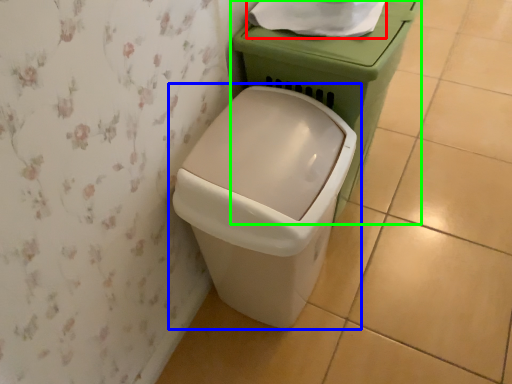
Question: Which is farther away from toilet paper (highlighted by a red box)? waste container (highlighted by a blue box) or porcelain (highlighted by a green box)?

Choices:
 (A) waste container
 (B) porcelain

Answer: (A)